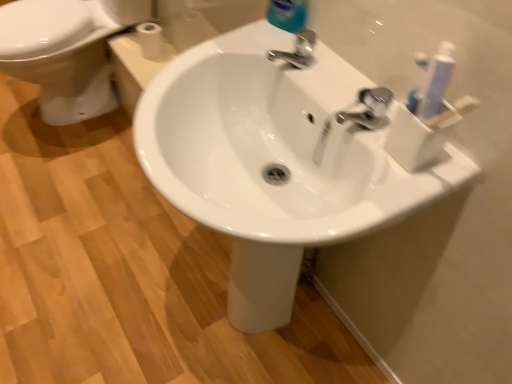
The image size is (512, 384). What are the coordinates of `free space to the right of silver metallic faucet at upper center, which is the 1th tap from left to right` in the screenshot? It's located at (335, 64).